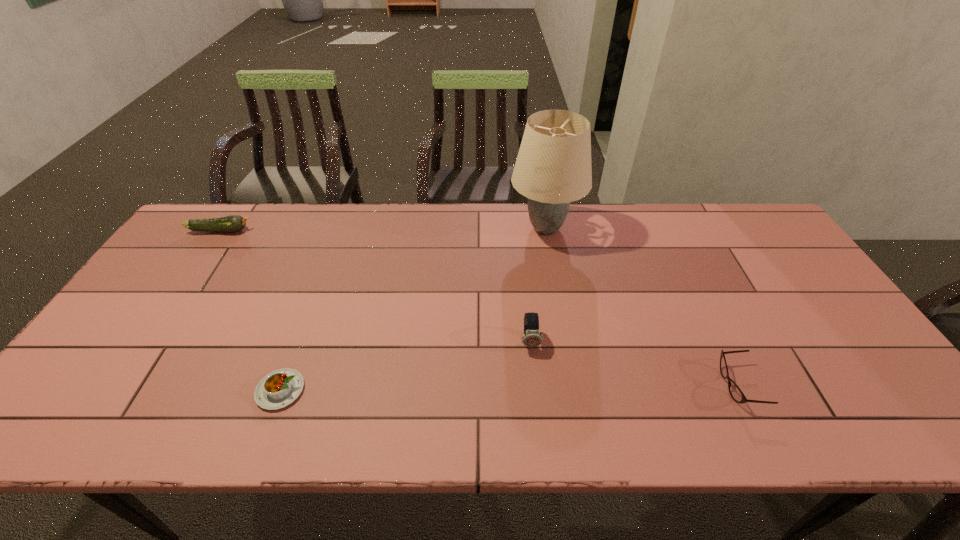
Locate an element on the screen. This screenshot has height=540, width=960. the tallest object is located at coordinates (553, 168).

I want to click on watch, so click(x=531, y=337).

In order to click on the third farthest object in this screenshot , I will do `click(531, 337)`.

Find the location of a particular element. Image resolution: width=960 pixels, height=540 pixels. the leftmost object is located at coordinates (233, 223).

Where is `the rightmost object`? The image size is (960, 540). the rightmost object is located at coordinates (737, 395).

Locate an element on the screen. The width and height of the screenshot is (960, 540). pudding is located at coordinates (276, 390).

The image size is (960, 540). I want to click on the second object from left to right, so click(276, 390).

Find the location of a particular element. The image size is (960, 540). vacant area located on the right of the tallest object is located at coordinates (668, 228).

Find the location of a particular element. free location located 0.140m on the face of the third farthest object is located at coordinates (537, 404).

Locate an element on the screen. This screenshot has height=540, width=960. free space located at the blossom end of the leftmost object is located at coordinates (293, 231).